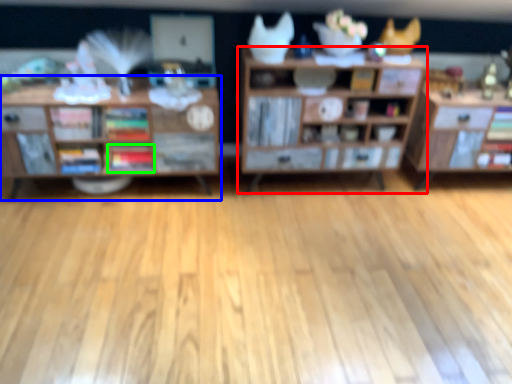
Question: Based on their relative distances, which object is farther from shelf (highlighted by a red box)? Choose from shelf (highlighted by a blue box) and book (highlighted by a green box).

Choices:
 (A) shelf
 (B) book

Answer: (B)